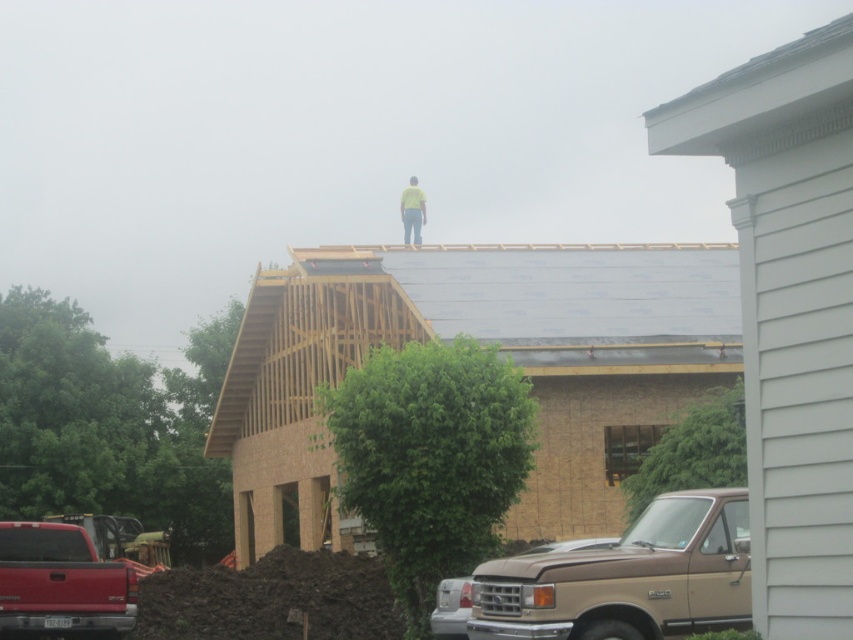
Question: Which of the following is the farthest from the observer?

Choices:
 (A) (665, 333)
 (B) (13, 620)
 (C) (722, 500)

Answer: (A)

Question: Does gray asphalt shingles at center have a smaller size compared to matte red truck at lower left?

Choices:
 (A) yes
 (B) no

Answer: (B)

Question: Which point is closer to the camera taking this photo?

Choices:
 (A) (727, 506)
 (B) (259, 330)
 (C) (405, 218)
 (D) (24, 540)

Answer: (A)

Question: Based on their relative distances, which object is farther from the gray asphalt shingles at center?

Choices:
 (A) matte red truck at lower left
 (B) yellow fabric construction worker at upper center

Answer: (A)

Question: Is matte red truck at lower left to the right of yellow fabric construction worker at upper center from the viewer's perspective?

Choices:
 (A) no
 (B) yes

Answer: (A)

Question: Does gray asphalt shingles at center have a lesser width compared to yellow fabric construction worker at upper center?

Choices:
 (A) yes
 (B) no

Answer: (B)